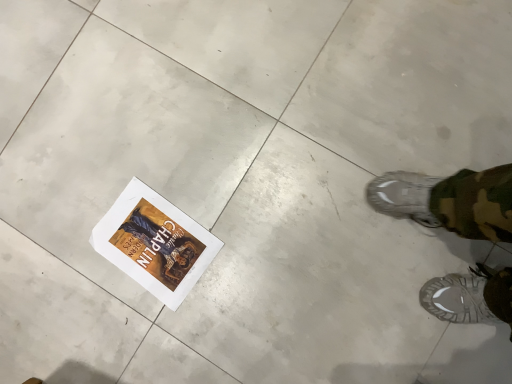
Find the location of a particular element. The image size is (512, 384). free space in front of white paper postcard at lower left is located at coordinates (210, 309).